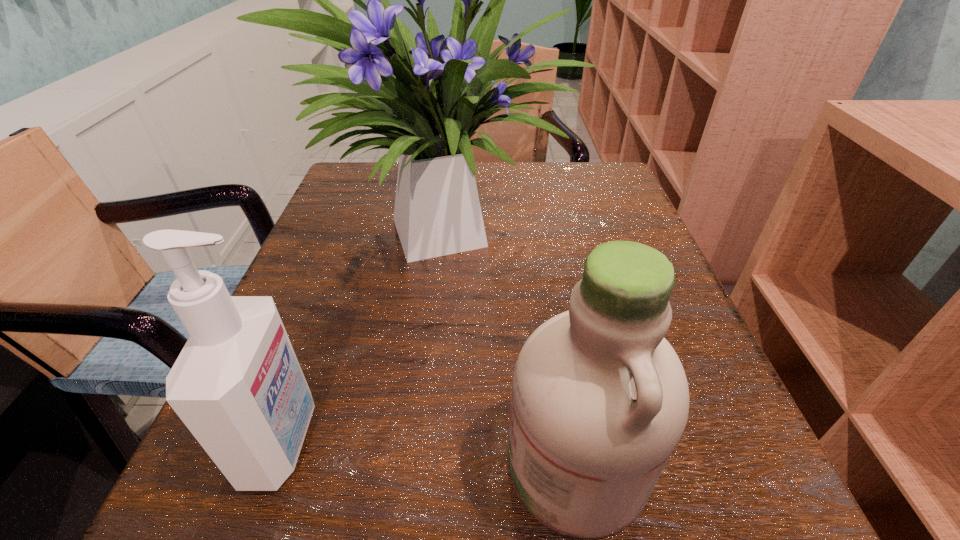
Identify the location of free space between the tallest object and the left cleansing agent. The height and width of the screenshot is (540, 960). (366, 333).

Locate an element on the screen. free space that is in between the left cleansing agent and the flower arrangement is located at coordinates (366, 333).

Where is `vacant region between the tallest object and the left cleansing agent`? The height and width of the screenshot is (540, 960). vacant region between the tallest object and the left cleansing agent is located at coordinates (366, 333).

Find the location of a particular element. The height and width of the screenshot is (540, 960). free space between the farthest object and the left cleansing agent is located at coordinates (366, 333).

You are a GUI agent. You are given a task and a screenshot of the screen. Output one action in this format:
    pyautogui.click(x=<x>, y=<y>)
    Task: Click on the object that is the second closest to the left cleansing agent
    
    Given the screenshot: What is the action you would take?
    pyautogui.click(x=600, y=399)

The image size is (960, 540). I want to click on the closest object to the tallest object, so click(237, 385).